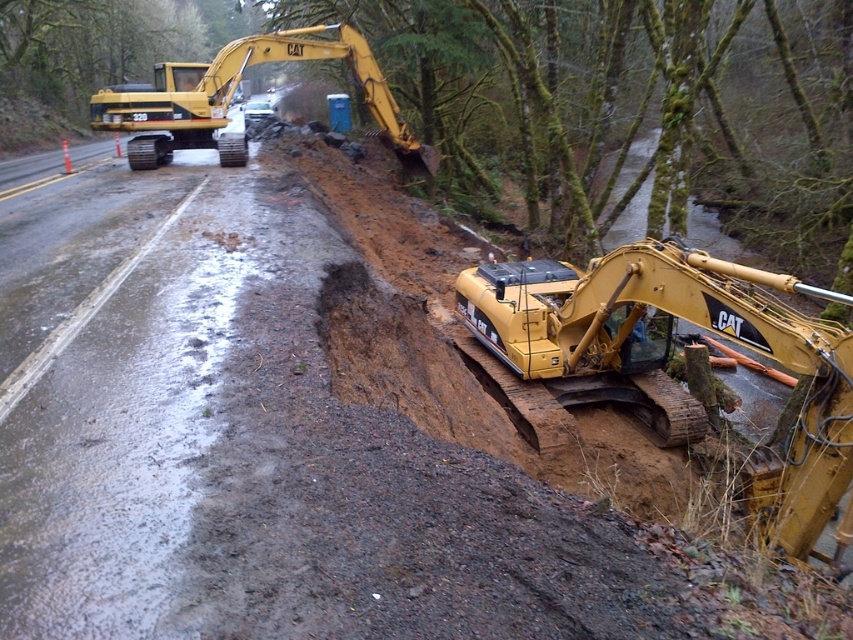
Measure the distance between yellow metallic excavator at center and yellow metallic excavator at upper left.

yellow metallic excavator at center is 41.92 feet from yellow metallic excavator at upper left.

Is yellow metallic excavator at center shorter than yellow metallic excavator at upper left?

Indeed, yellow metallic excavator at center has a lesser height compared to yellow metallic excavator at upper left.

Where is `yellow metallic excavator at center`? The width and height of the screenshot is (853, 640). yellow metallic excavator at center is located at coordinates (666, 352).

Image resolution: width=853 pixels, height=640 pixels. I want to click on yellow metallic excavator at center, so click(x=666, y=352).